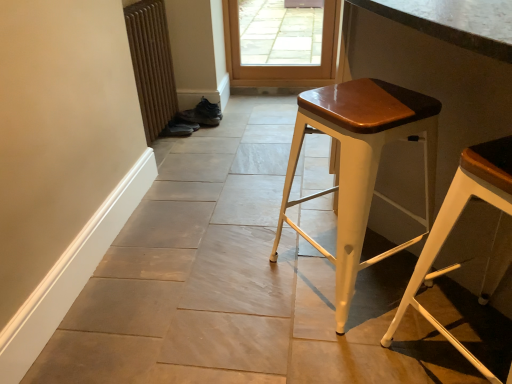
What is the approximate height of brown textured radiator at lower left?

brown textured radiator at lower left is 29.59 inches in height.

Describe the element at coordinates (179, 128) in the screenshot. I see `shiny black shoe at lower center, which is the 2th shoe in top-to-bottom order` at that location.

Consider the image. In order to face white metal stool at right, marked as the 1th stool in a right-to-left arrangement, should I rotate leftwards or rightwards?

Turn right approximately 30.874 degrees to face it.

Locate an element on the screen. brown textured radiator at lower left is located at coordinates (152, 64).

There is a matte white stool at center, which is the 1th stool from left to right. What are the coordinates of `the 2nd shoe below it (from a real-world perspective)` in the screenshot? It's located at (179, 128).

Between point (365, 207) and point (170, 123), which one is positioned behind?

The point (170, 123) is more distant.

Which of these two, matte white stool at center, which is the 1th stool from left to right, or shiny black shoe at lower center, which appears as the first shoe when ordered from the bottom, is thinner?

shiny black shoe at lower center, which appears as the first shoe when ordered from the bottom, is thinner.

In the scene shown: What's the angular difference between matte white stool at center, which is counted as the second stool, starting from the right, and shiny black shoe at lower center, which is the 2th shoe in top-to-bottom order,'s facing directions?

The angular difference between matte white stool at center, which is counted as the second stool, starting from the right, and shiny black shoe at lower center, which is the 2th shoe in top-to-bottom order, is 36 degrees.

Is shiny black shoe at lower center, which is the 2th shoe in top-to-bottom order, far away from matte white stool at center, which is counted as the second stool, starting from the right?

That's right, there is a large distance between shiny black shoe at lower center, which is the 2th shoe in top-to-bottom order, and matte white stool at center, which is counted as the second stool, starting from the right.

Is shiny black shoe at lower center, which appears as the first shoe when ordered from the bottom, positioned behind matte white stool at center, which is the 1th stool from left to right?

Yes, shiny black shoe at lower center, which appears as the first shoe when ordered from the bottom, is further from the viewer.

Considering the points (170, 134) and (311, 96), which point is behind, point (170, 134) or point (311, 96)?

The point (170, 134) is more distant.

Considering the relative sizes of shiny black shoe at lower center, which is the 2th shoe in top-to-bottom order, and matte white stool at center, which is the 1th stool from left to right, in the image provided, is shiny black shoe at lower center, which is the 2th shoe in top-to-bottom order, shorter than matte white stool at center, which is the 1th stool from left to right,?

Indeed, shiny black shoe at lower center, which is the 2th shoe in top-to-bottom order, has a lesser height compared to matte white stool at center, which is the 1th stool from left to right.

How distant is leather brown shoe at center, the 2th shoe when ordered from bottom to top, from white metal stool at right, marked as the 1th stool in a right-to-left arrangement?

leather brown shoe at center, the 2th shoe when ordered from bottom to top, is 6.52 feet from white metal stool at right, marked as the 1th stool in a right-to-left arrangement.

Is leather brown shoe at center, the 2th shoe when ordered from bottom to top, smaller than white metal stool at right, the 2th stool viewed from the left?

Yes, leather brown shoe at center, the 2th shoe when ordered from bottom to top, is smaller than white metal stool at right, the 2th stool viewed from the left.

From the image's perspective, is leather brown shoe at center, the 1th shoe viewed from the top, located above white metal stool at right, the 2th stool viewed from the left?

Indeed, from the image's perspective, leather brown shoe at center, the 1th shoe viewed from the top, is shown above white metal stool at right, the 2th stool viewed from the left.

Does brown textured radiator at lower left have a smaller size compared to matte white stool at center, which is counted as the second stool, starting from the right?

Correct, brown textured radiator at lower left occupies less space than matte white stool at center, which is counted as the second stool, starting from the right.

Is brown textured radiator at lower left spatially inside matte white stool at center, which is counted as the second stool, starting from the right, or outside of it?

brown textured radiator at lower left is located beyond the bounds of matte white stool at center, which is counted as the second stool, starting from the right.

Is brown textured radiator at lower left oriented away from matte white stool at center, which is counted as the second stool, starting from the right?

brown textured radiator at lower left is not turned away from matte white stool at center, which is counted as the second stool, starting from the right.

From a real-world perspective, is brown textured radiator at lower left below matte white stool at center, which is the 1th stool from left to right?

Incorrect, from a real-world perspective, brown textured radiator at lower left is higher than matte white stool at center, which is the 1th stool from left to right.

Between point (180, 117) and point (164, 135), which one is positioned behind?

The point (180, 117) is farther.

Would you consider leather brown shoe at center, the 2th shoe when ordered from bottom to top, to be distant from shiny black shoe at lower center, which appears as the first shoe when ordered from the bottom?

No.

Considering their positions, is leather brown shoe at center, the 2th shoe when ordered from bottom to top, located in front of or behind shiny black shoe at lower center, which appears as the first shoe when ordered from the bottom?

Visually, leather brown shoe at center, the 2th shoe when ordered from bottom to top, is located behind shiny black shoe at lower center, which appears as the first shoe when ordered from the bottom.

Does leather brown shoe at center, the 1th shoe viewed from the top, have a lesser height compared to shiny black shoe at lower center, which appears as the first shoe when ordered from the bottom?

In fact, leather brown shoe at center, the 1th shoe viewed from the top, may be taller than shiny black shoe at lower center, which appears as the first shoe when ordered from the bottom.

Looking at their sizes, would you say white metal stool at right, marked as the 1th stool in a right-to-left arrangement, is wider or thinner than brown textured radiator at lower left?

Clearly, white metal stool at right, marked as the 1th stool in a right-to-left arrangement, has more width compared to brown textured radiator at lower left.

From the image's perspective, is white metal stool at right, the 2th stool viewed from the left, above or below brown textured radiator at lower left?

Clearly, from the image's perspective, white metal stool at right, the 2th stool viewed from the left, is below brown textured radiator at lower left.

Can you confirm if white metal stool at right, the 2th stool viewed from the left, is shorter than brown textured radiator at lower left?

Indeed, white metal stool at right, the 2th stool viewed from the left, has a lesser height compared to brown textured radiator at lower left.

Does white metal stool at right, marked as the 1th stool in a right-to-left arrangement, have a larger size compared to shiny black shoe at lower center, which appears as the first shoe when ordered from the bottom?

Correct, white metal stool at right, marked as the 1th stool in a right-to-left arrangement, is larger in size than shiny black shoe at lower center, which appears as the first shoe when ordered from the bottom.

This screenshot has height=384, width=512. I want to click on the 2nd stool below the shiny black shoe at lower center, which is the 2th shoe in top-to-bottom order (from the image's perspective), so click(x=455, y=223).

Between point (449, 215) and point (186, 133), which one is positioned in front?

Point (449, 215)

Is white metal stool at right, the 2th stool viewed from the left, taller than shiny black shoe at lower center, which appears as the first shoe when ordered from the bottom?

Yes.

Locate an element on the screen. Image resolution: width=512 pixels, height=384 pixels. the 1st shoe behind the matte white stool at center, which is the 1th stool from left to right is located at coordinates (179, 128).

Where is `the 1st stool to the right of the shiny black shoe at lower center, which appears as the first shoe when ordered from the bottom, starting your count from the anchor`? the 1st stool to the right of the shiny black shoe at lower center, which appears as the first shoe when ordered from the bottom, starting your count from the anchor is located at coordinates (360, 165).

Consider the image. Which object lies further to the anchor point white metal stool at right, the 2th stool viewed from the left, matte white stool at center, which is the 1th stool from left to right, or brown textured radiator at lower left?

Among the two, brown textured radiator at lower left is located further to white metal stool at right, the 2th stool viewed from the left.

When comparing their distances from shiny black shoe at lower center, which appears as the first shoe when ordered from the bottom, does brown textured radiator at lower left or white metal stool at right, the 2th stool viewed from the left, seem further?

white metal stool at right, the 2th stool viewed from the left.

Considering their positions, is brown textured radiator at lower left positioned further to white metal stool at right, the 2th stool viewed from the left, than shiny black shoe at lower center, which is the 2th shoe in top-to-bottom order?

shiny black shoe at lower center, which is the 2th shoe in top-to-bottom order.

Estimate the real-world distances between objects in this image. Which object is further from white metal stool at right, the 2th stool viewed from the left, shiny black shoe at lower center, which appears as the first shoe when ordered from the bottom, or matte white stool at center, which is counted as the second stool, starting from the right?

shiny black shoe at lower center, which appears as the first shoe when ordered from the bottom, is further to white metal stool at right, the 2th stool viewed from the left.

Looking at the image, which one is located further to brown textured radiator at lower left, white metal stool at right, the 2th stool viewed from the left, or shiny black shoe at lower center, which appears as the first shoe when ordered from the bottom?

white metal stool at right, the 2th stool viewed from the left, is further to brown textured radiator at lower left.

Based on their spatial positions, is shiny black shoe at lower center, which appears as the first shoe when ordered from the bottom, or white metal stool at right, the 2th stool viewed from the left, closer to brown textured radiator at lower left?

shiny black shoe at lower center, which appears as the first shoe when ordered from the bottom, is positioned closer to the anchor brown textured radiator at lower left.

Based on their spatial positions, is leather brown shoe at center, the 1th shoe viewed from the top, or matte white stool at center, which is the 1th stool from left to right, further from shiny black shoe at lower center, which is the 2th shoe in top-to-bottom order?

Among the two, matte white stool at center, which is the 1th stool from left to right, is located further to shiny black shoe at lower center, which is the 2th shoe in top-to-bottom order.

Based on their spatial positions, is leather brown shoe at center, the 1th shoe viewed from the top, or brown textured radiator at lower left further from white metal stool at right, the 2th stool viewed from the left?

leather brown shoe at center, the 1th shoe viewed from the top, is positioned further to the anchor white metal stool at right, the 2th stool viewed from the left.

I want to click on shoe positioned between brown textured radiator at lower left and leather brown shoe at center, the 2th shoe when ordered from bottom to top, from near to far, so click(x=179, y=128).

At what (x,y) coordinates should I click in order to perform the action: click on radiator between matte white stool at center, which is the 1th stool from left to right, and leather brown shoe at center, the 1th shoe viewed from the top, in the front-back direction. Please return your answer as a coordinate pair (x, y). Looking at the image, I should click on (152, 64).

Image resolution: width=512 pixels, height=384 pixels. Find the location of `radiator between white metal stool at right, marked as the 1th stool in a right-to-left arrangement, and leather brown shoe at center, the 1th shoe viewed from the top, from front to back`. radiator between white metal stool at right, marked as the 1th stool in a right-to-left arrangement, and leather brown shoe at center, the 1th shoe viewed from the top, from front to back is located at coordinates (152, 64).

The height and width of the screenshot is (384, 512). I want to click on stool located between white metal stool at right, the 2th stool viewed from the left, and leather brown shoe at center, the 2th shoe when ordered from bottom to top, in the depth direction, so click(x=360, y=165).